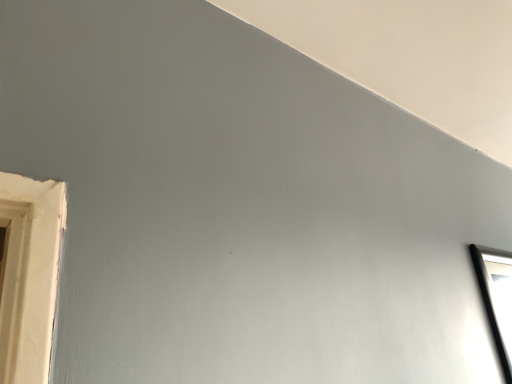
Image resolution: width=512 pixels, height=384 pixels. Describe the element at coordinates (494, 301) in the screenshot. I see `black glass window at upper right` at that location.

Image resolution: width=512 pixels, height=384 pixels. I want to click on black glass window at upper right, so click(x=494, y=301).

At what (x,y) coordinates should I click in order to perform the action: click on black glass window at upper right. Please return your answer as a coordinate pair (x, y). The height and width of the screenshot is (384, 512). Looking at the image, I should click on (494, 301).